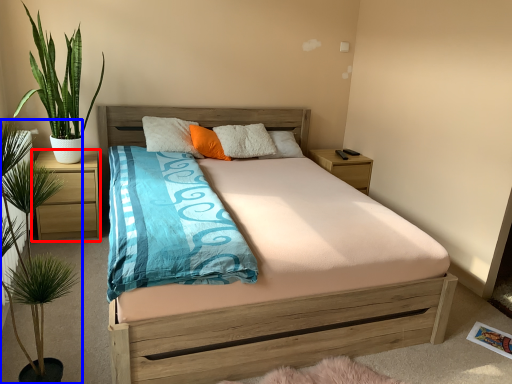
Question: Which point is further to the camera, nightstand (highlighted by a red box) or houseplant (highlighted by a blue box)?

Choices:
 (A) nightstand
 (B) houseplant

Answer: (A)